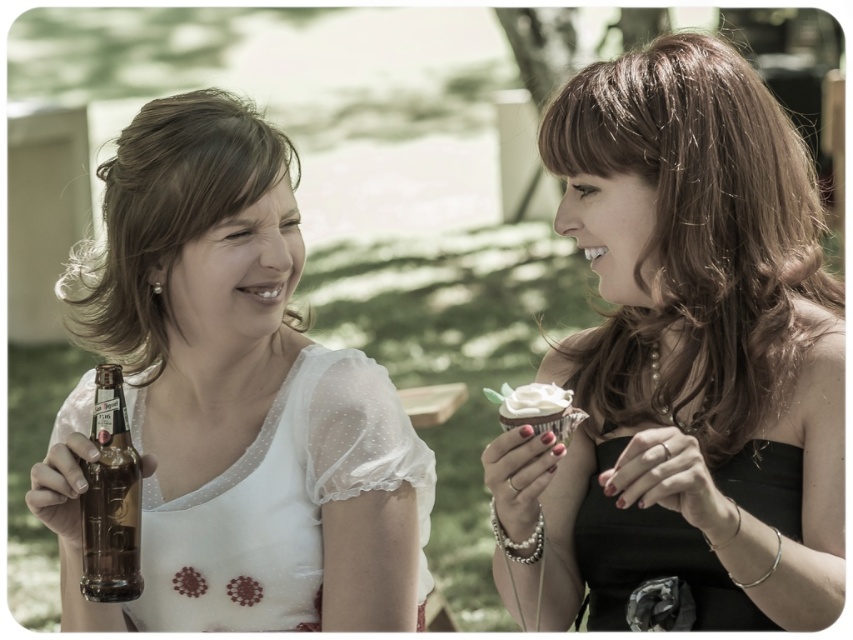
Is matte glass beer bottle at left to the left of white frosted cupcake at right from the viewer's perspective?

Yes, matte glass beer bottle at left is to the left of white frosted cupcake at right.

The width and height of the screenshot is (853, 640). Describe the element at coordinates (247, 392) in the screenshot. I see `matte glass beer bottle at left` at that location.

Locate an element on the screen. The width and height of the screenshot is (853, 640). matte glass beer bottle at left is located at coordinates (247, 392).

Is matte white blouse at left below brown glass beer bottle at lower left?

No.

Is matte white blouse at left smaller than brown glass beer bottle at lower left?

No.

Which is behind, point (148, 360) or point (82, 468)?

Positioned behind is point (148, 360).

I want to click on matte white blouse at left, so click(165, 216).

Can you confirm if matte black dress at right is shorter than matte white blouse at left?

No, matte black dress at right is not shorter than matte white blouse at left.

Which is below, matte black dress at right or matte white blouse at left?

matte black dress at right

Identify the location of matte black dress at right. The height and width of the screenshot is (640, 853). (683, 360).